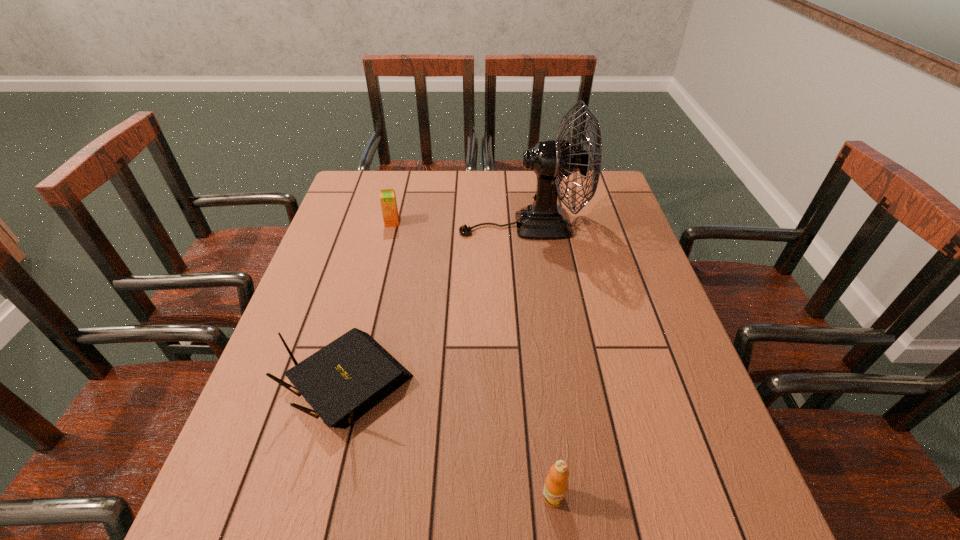
Where is `object located in the far edge section of the desktop`? The image size is (960, 540). object located in the far edge section of the desktop is located at coordinates (552, 160).

At what (x,y) coordinates should I click in order to perform the action: click on object located at the near edge. Please return your answer as a coordinate pair (x, y). The height and width of the screenshot is (540, 960). Looking at the image, I should click on (556, 484).

Locate an element on the screen. object positioned at the left edge is located at coordinates (345, 379).

At what (x,y) coordinates should I click in order to perform the action: click on object at the right edge. Please return your answer as a coordinate pair (x, y). The height and width of the screenshot is (540, 960). Looking at the image, I should click on (552, 160).

In order to click on object located in the far right corner section of the desktop in this screenshot , I will do `click(552, 160)`.

This screenshot has width=960, height=540. Find the location of `vacant space at the far edge of the desktop`. vacant space at the far edge of the desktop is located at coordinates (433, 200).

This screenshot has height=540, width=960. Identify the location of free spot at the near edge of the desktop. (616, 523).

Identify the location of free space at the left edge of the desktop. The height and width of the screenshot is (540, 960). (240, 492).

Identify the location of vacant area at the right edge of the desktop. (664, 430).

Where is `blank region between the fan and the second nearest object`? This screenshot has width=960, height=540. blank region between the fan and the second nearest object is located at coordinates (436, 303).